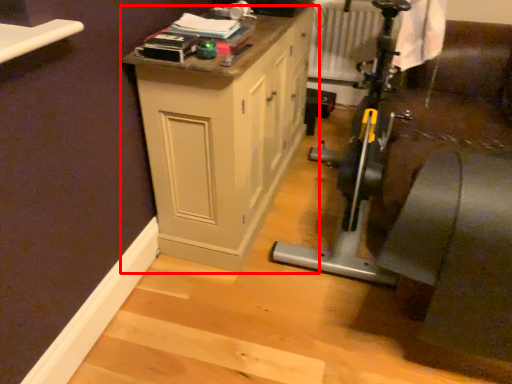
Question: From the image's perspective, what is the correct spatial relationship of cabinetry (annotated by the red box) in relation to radiator?

Choices:
 (A) below
 (B) above

Answer: (A)